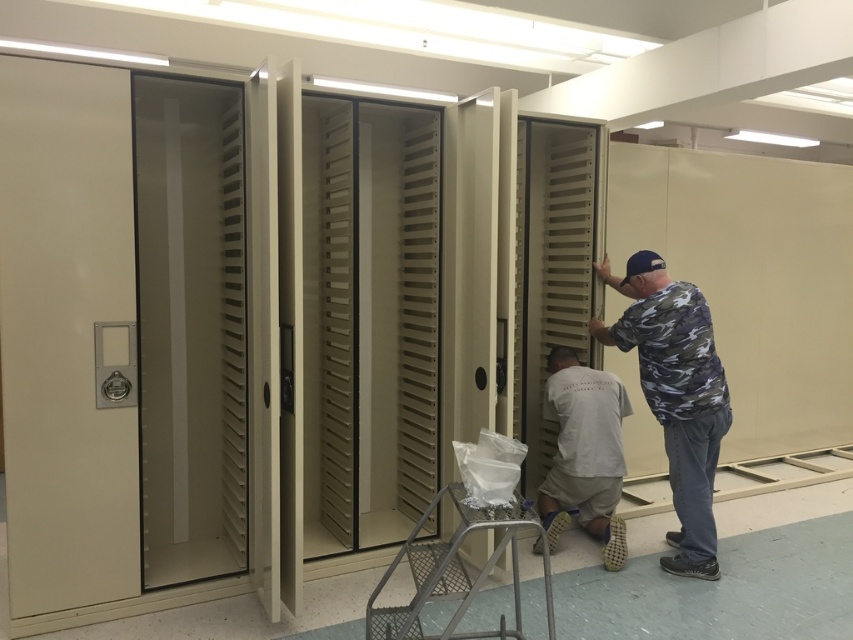
You are organizing a clothing inventory and need to place the camo shirt at right and white cotton shirt at center into storage. Given their positions in the image, which shirt should you place first to maintain the order shown?

The camo shirt at right should be placed first since it is positioned on the right side of the white cotton shirt at center, indicating it should be placed to the right of the other shirt.

You are standing in front of the storage units and want to reach the point marked at coordinates point (303,481). If your arm can extend 1.5 meters, can you touch that point without moving closer?

The point (303,481) is 3.92 meters away from the viewer. Since your arm can only extend 1.5 meters, you cannot reach it without moving closer.

Consider the image. You are standing in front of the storage units and notice two people working. Which person, the camo shirt at right or the white cotton shirt at center, is positioned higher up?

The camo shirt at right is above the white cotton shirt at center, so the person in the camo shirt at right is positioned higher up.